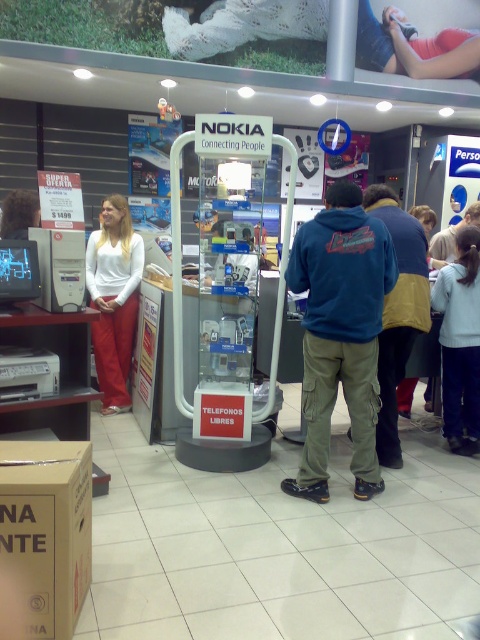
Consider the image. Can you confirm if brown cardboard box at lower left is wider than matte white blouse at center?

In fact, brown cardboard box at lower left might be narrower than matte white blouse at center.

Is point (41, 448) in front of point (127, 365)?

That is True.

Is point (82, 480) positioned after point (94, 282)?

No, (82, 480) is closer to viewer.

I want to click on brown cardboard box at lower left, so click(x=48, y=529).